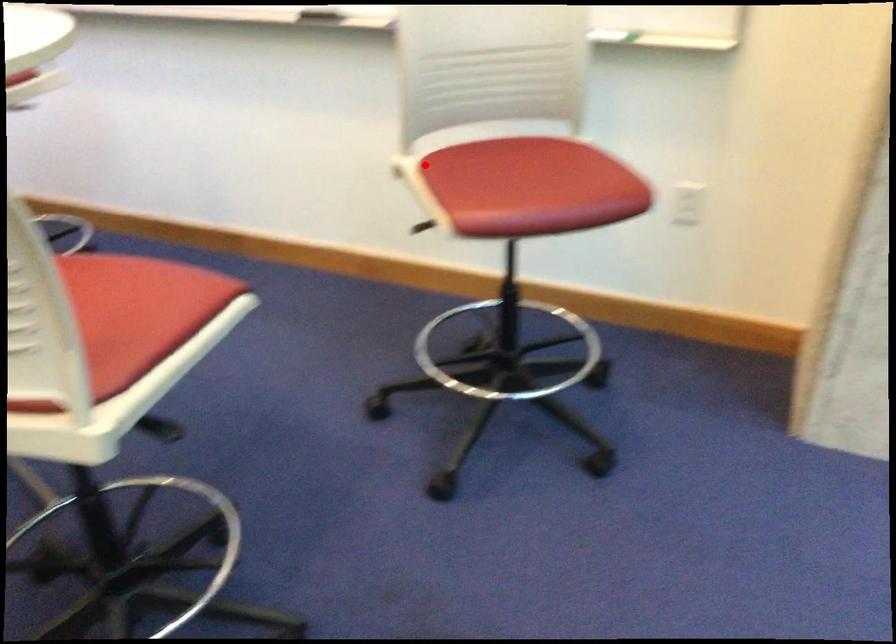
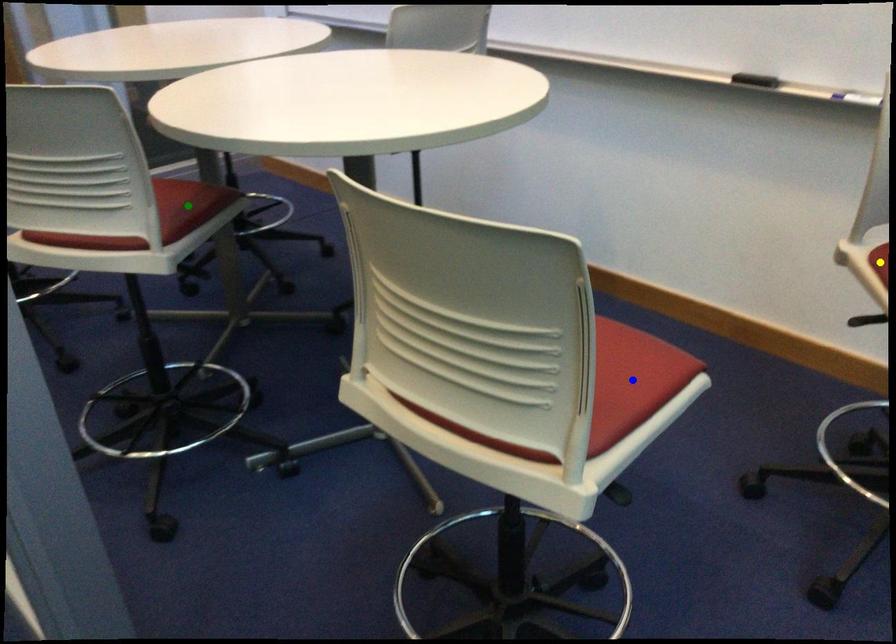
Question: I am providing you with two images of the same scene from different viewpoints. A red point is marked on the first image. You are given multiple points on the second image. Which point in image 2 is actually the same real-world point as the red point in image 1?

Choices:
 (A) yellow point
 (B) blue point
 (C) green point

Answer: (A)